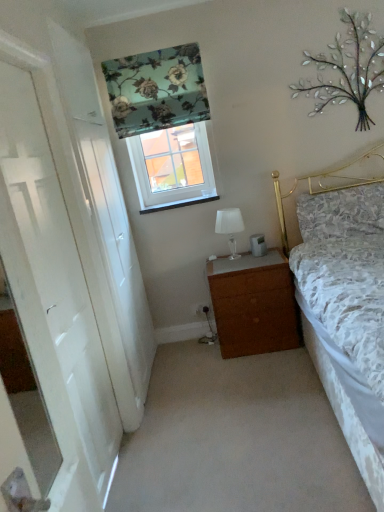
In order to click on free space below floral fabric curtain at upper center (from a real-world perspective) in this screenshot , I will do `click(190, 333)`.